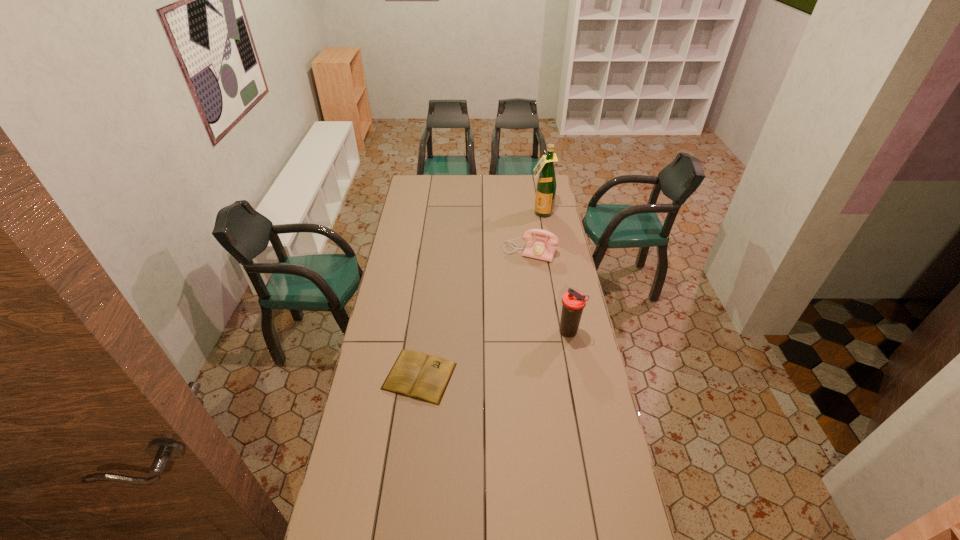
In the image, there is a desktop. Where is `vacant space at the far edge`? vacant space at the far edge is located at coordinates (434, 184).

Locate an element on the screen. This screenshot has width=960, height=540. vacant space at the left edge of the desktop is located at coordinates (417, 221).

Identify the location of vacant area at the far right corner. click(532, 177).

Locate an element on the screen. empty space that is in between the book and the third shortest object is located at coordinates (494, 354).

This screenshot has height=540, width=960. Identify the location of free point between the second farthest object and the third farthest object. (549, 292).

At what (x,y) coordinates should I click in order to perform the action: click on vacant space in between the third farthest object and the telephone. Please return your answer as a coordinate pair (x, y). The height and width of the screenshot is (540, 960). Looking at the image, I should click on (549, 292).

Locate an element on the screen. The width and height of the screenshot is (960, 540). vacant space in between the second shortest object and the second nearest object is located at coordinates pyautogui.click(x=549, y=292).

I want to click on free point between the second tallest object and the farthest object, so click(x=556, y=273).

You are a GUI agent. You are given a task and a screenshot of the screen. Output one action in this format:
    pyautogui.click(x=<x>, y=<y>)
    Task: Click on the free spot between the tallest object and the shortest object
    This screenshot has width=960, height=540.
    Given the screenshot: What is the action you would take?
    pyautogui.click(x=481, y=294)

Locate an element on the screen. The image size is (960, 540). free space between the leftmost object and the telephone is located at coordinates (475, 314).